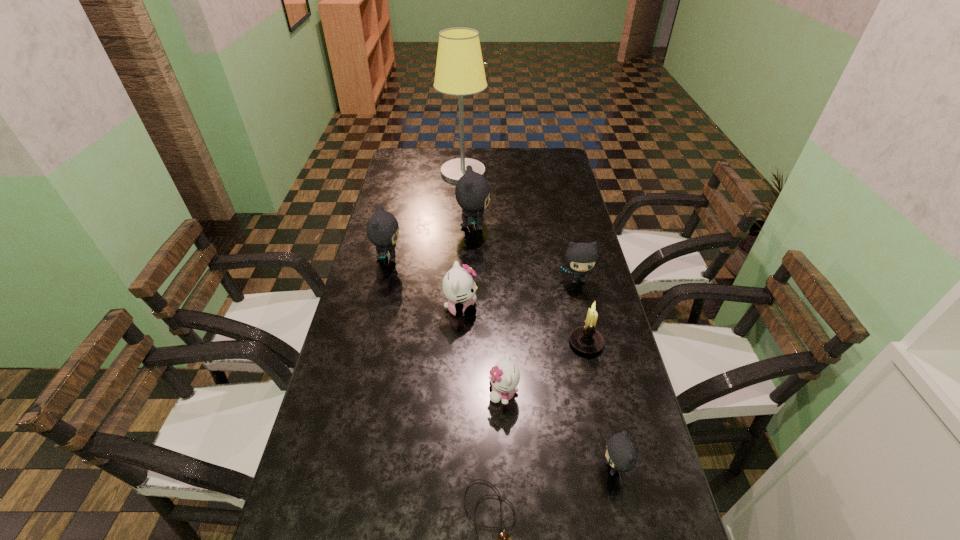
This screenshot has width=960, height=540. What are the coordinates of `vacant space located on the front-facing side of the third biggest gray kitten` in the screenshot? It's located at (586, 317).

You are a GUI agent. You are given a task and a screenshot of the screen. Output one action in this format:
    pyautogui.click(x=<x>, y=<y>)
    Task: Click on the free region located on the front-facing side of the right white kitten
    The image size is (960, 540).
    Given the screenshot: What is the action you would take?
    pyautogui.click(x=397, y=393)

Where is `free spot located 0.390m on the front-facing side of the right white kitten`? The height and width of the screenshot is (540, 960). free spot located 0.390m on the front-facing side of the right white kitten is located at coordinates (334, 393).

Where is `free location located 0.320m on the front-facing side of the right white kitten`? The height and width of the screenshot is (540, 960). free location located 0.320m on the front-facing side of the right white kitten is located at coordinates (362, 393).

Find the location of `free space located on the front-facing side of the smallest gray kitten`. free space located on the front-facing side of the smallest gray kitten is located at coordinates (496, 468).

Find the location of `vacant area located 0.260m on the front-facing side of the smallest gray kitten`. vacant area located 0.260m on the front-facing side of the smallest gray kitten is located at coordinates (483, 468).

Image resolution: width=960 pixels, height=540 pixels. Find the location of `vacant space located 0.150m on the front-facing side of the smallest gray kitten`. vacant space located 0.150m on the front-facing side of the smallest gray kitten is located at coordinates (533, 468).

Identify the location of object located at the far edge. (459, 71).

The height and width of the screenshot is (540, 960). In order to click on object positioned at the left edge in this screenshot , I will do `click(382, 228)`.

The image size is (960, 540). Identify the location of candle holder at the right edge. (586, 339).